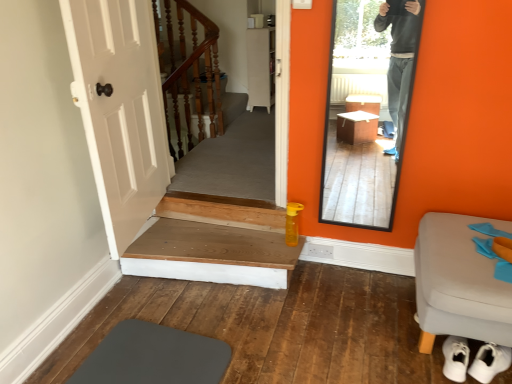
Locate an element on the screen. The height and width of the screenshot is (384, 512). free space between white fabric stool at lower right and wooden at bottom, marked as the 2th stairs in a top-to-bottom arrangement is located at coordinates (345, 318).